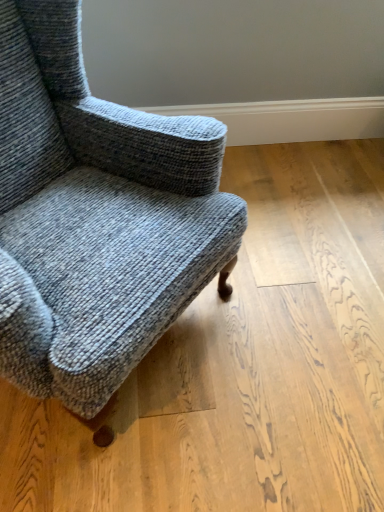
Where is `textured gray armchair at center`? The width and height of the screenshot is (384, 512). textured gray armchair at center is located at coordinates click(96, 218).

The width and height of the screenshot is (384, 512). What do you see at coordinates (96, 218) in the screenshot?
I see `textured gray armchair at center` at bounding box center [96, 218].

At what (x,y) coordinates should I click in order to perform the action: click on textured gray armchair at center. Please return your answer as a coordinate pair (x, y). The width and height of the screenshot is (384, 512). Looking at the image, I should click on (96, 218).